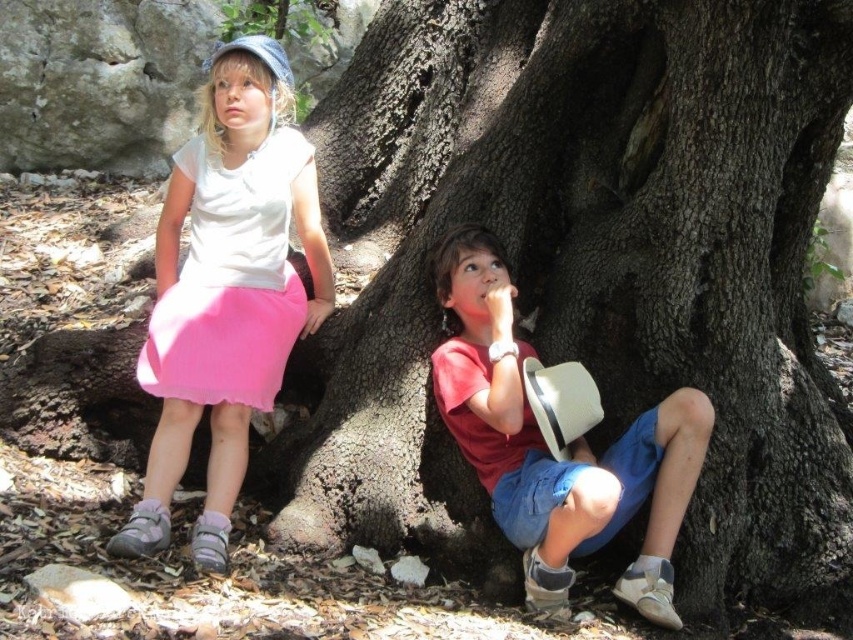
Question: Can you confirm if rough bark tree at center is positioned to the right of matte pink skirt at left?

Choices:
 (A) no
 (B) yes

Answer: (B)

Question: From the image, what is the correct spatial relationship of rough bark tree at center in relation to matte red shirt at center?

Choices:
 (A) right
 (B) left

Answer: (A)

Question: Which point is closer to the camera taking this photo?

Choices:
 (A) (167, 435)
 (B) (299, 348)
 (C) (651, 408)

Answer: (A)

Question: Which is farther from the rough bark tree at center?

Choices:
 (A) matte red shirt at center
 (B) matte pink skirt at left

Answer: (B)

Question: Which of the following is the farthest from the observer?

Choices:
 (A) (492, 305)
 (B) (293, 500)
 (C) (222, 257)

Answer: (C)

Question: Is rough bark tree at center closer to the viewer compared to matte red shirt at center?

Choices:
 (A) yes
 (B) no

Answer: (B)